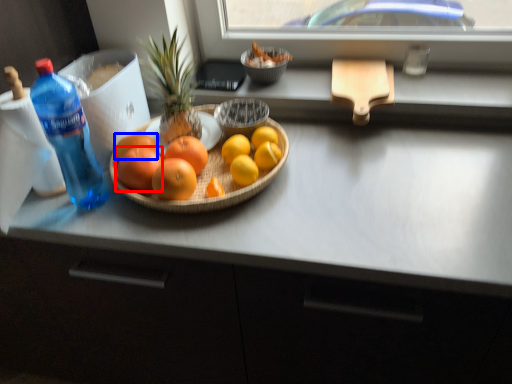
Question: Which point is further to the camera, grapefruit (highlighted by a red box) or grapefruit (highlighted by a blue box)?

Choices:
 (A) grapefruit
 (B) grapefruit

Answer: (B)